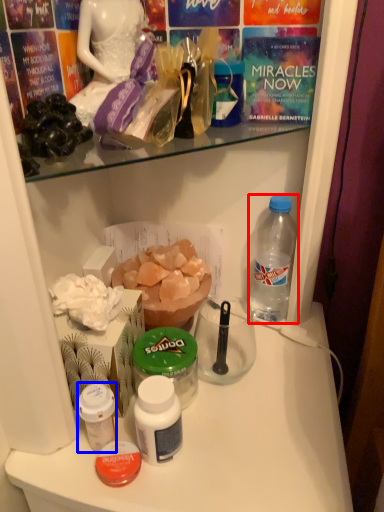
Question: Which object appears farthest to the camera in this image, bottle (highlighted by a red box) or bottle (highlighted by a blue box)?

Choices:
 (A) bottle
 (B) bottle

Answer: (A)